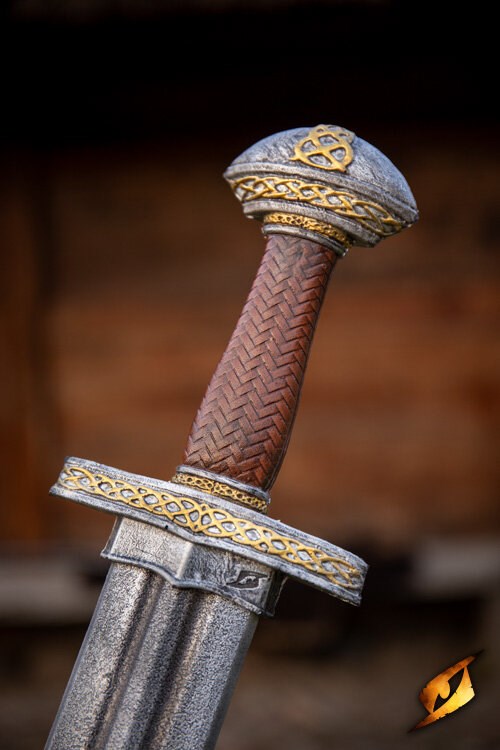
The width and height of the screenshot is (500, 750). I want to click on wall, so click(438, 445).